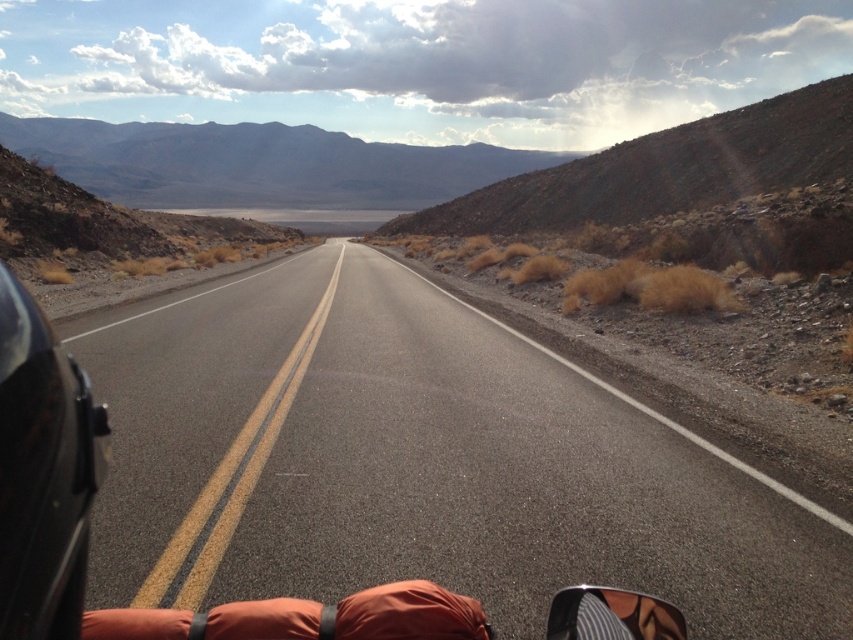
Question: Does black glossy motorcycle at left appear on the right side of orange fabric sleeping bag at lower center?

Choices:
 (A) no
 (B) yes

Answer: (A)

Question: Which object appears farthest from the camera in this image?

Choices:
 (A) black asphalt road at center
 (B) black glossy motorcycle at left

Answer: (A)

Question: Can you confirm if black glossy motorcycle at left is smaller than orange fabric sleeping bag at lower center?

Choices:
 (A) yes
 (B) no

Answer: (B)

Question: Among these points, which one is nearest to the camera?

Choices:
 (A) (650, 493)
 (B) (48, 412)
 (C) (84, 627)

Answer: (B)

Question: Among these objects, which one is farthest from the camera?

Choices:
 (A) black glossy motorcycle at left
 (B) black asphalt road at center
 (C) orange fabric sleeping bag at lower center

Answer: (B)

Question: Does black asphalt road at center have a greater width compared to orange fabric sleeping bag at lower center?

Choices:
 (A) yes
 (B) no

Answer: (A)